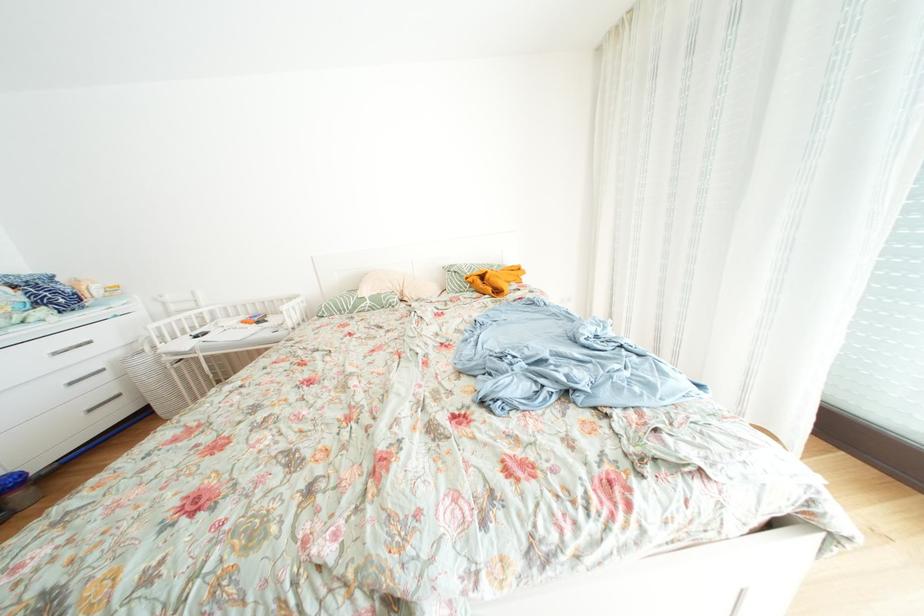
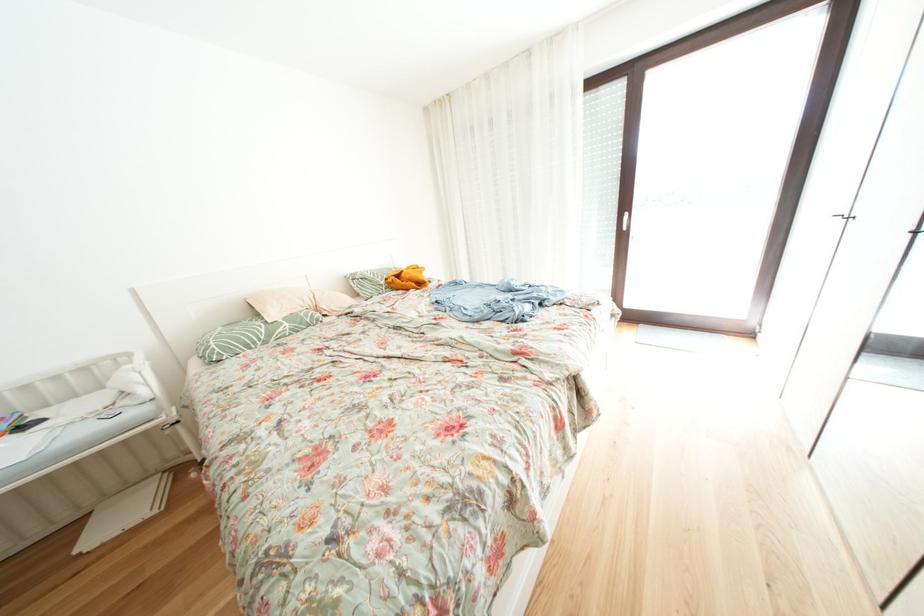
Locate, in the second image, the point that corresponds to the point at 378,307 in the first image.

(296, 329)